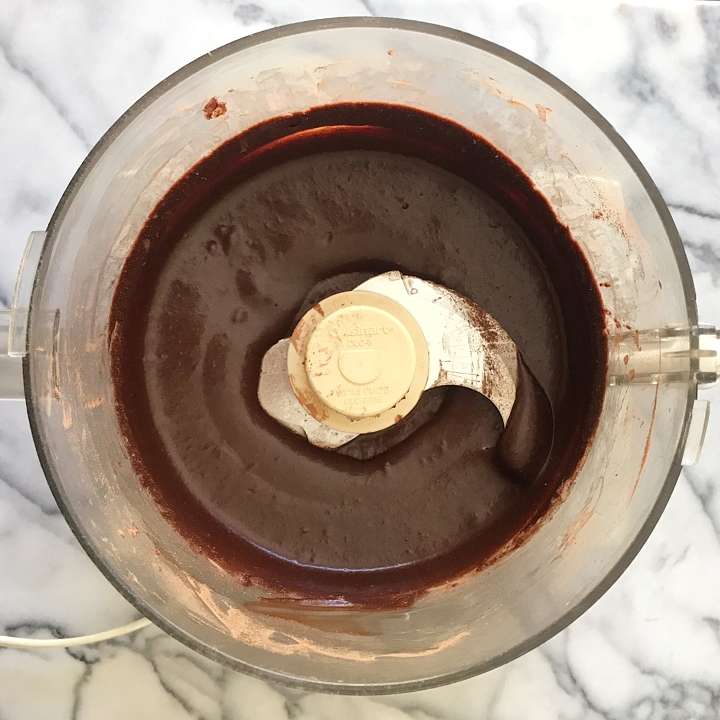
I want to click on glass container, so (387, 685).